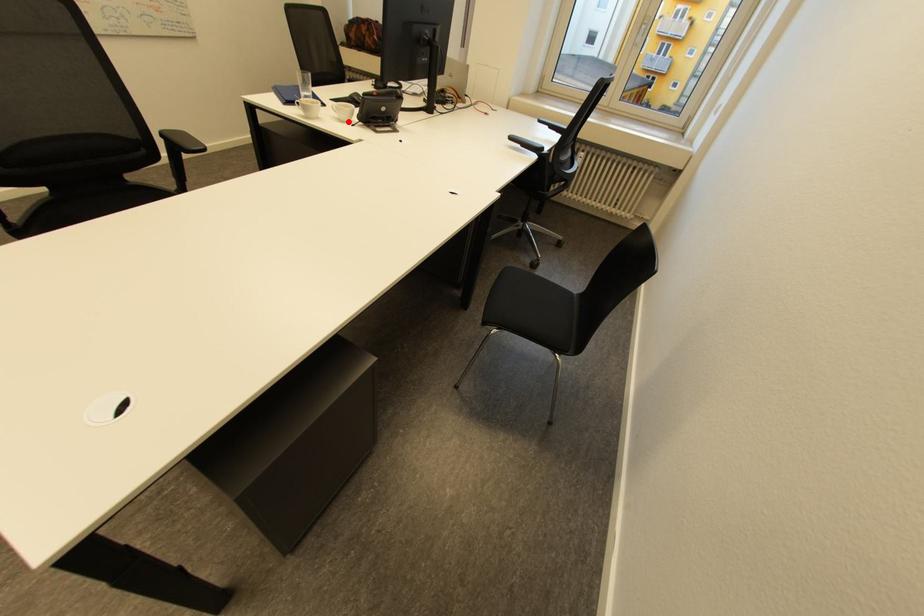
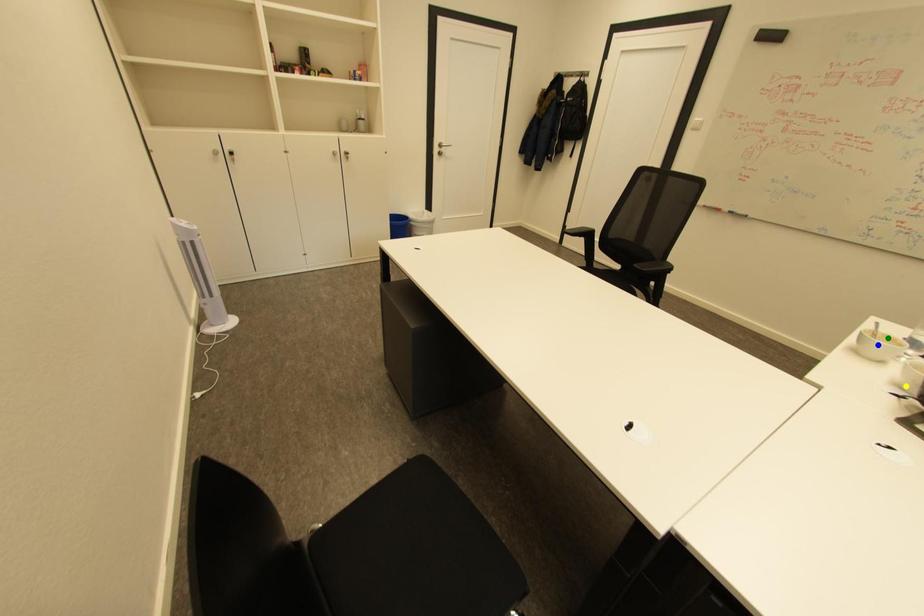
Question: I am providing you with two images of the same scene from different viewpoints. A red point is marked on the first image. You are given multiple points on the second image. Can you choose the point in image 2 that corresponds to the point in image 1?

Choices:
 (A) blue point
 (B) yellow point
 (C) green point

Answer: (B)